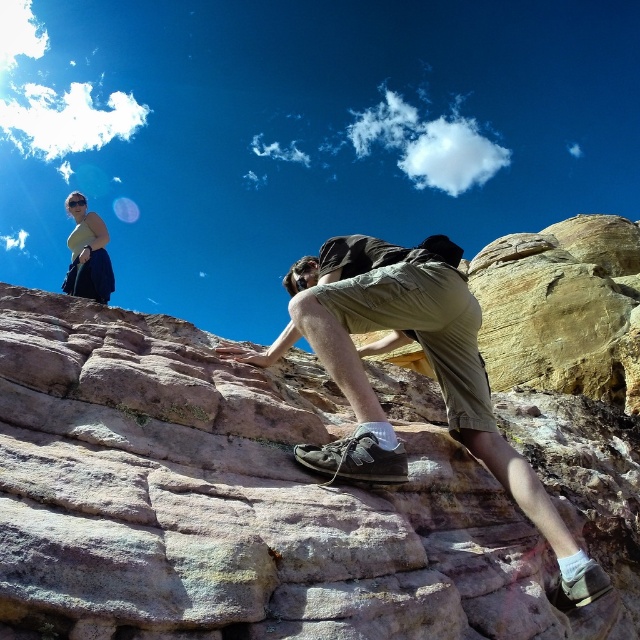
You are observing a climber in a rocky landscape. The climber is wearing two items of clothing. One is the matte khaki shorts at center, and the other is the matte yellow top at upper left. Which clothing item is positioned higher up on the climber?

The matte yellow top at upper left is positioned higher up on the climber because it has a greater height compared to the matte khaki shorts at center.

Looking at this image, you are a hiker observing the scene. You notice the matte khaki shorts at center and the matte yellow top at upper left. Which clothing item appears smaller in size?

The matte khaki shorts at center appears smaller in size compared to the matte yellow top at upper left.

From the picture: You are a hiker trying to reach the top of the rock formation. There is a point marked at coordinates (429, 362). What object is located at that point?

The object at point (429, 362) is the matte khaki shorts at center.